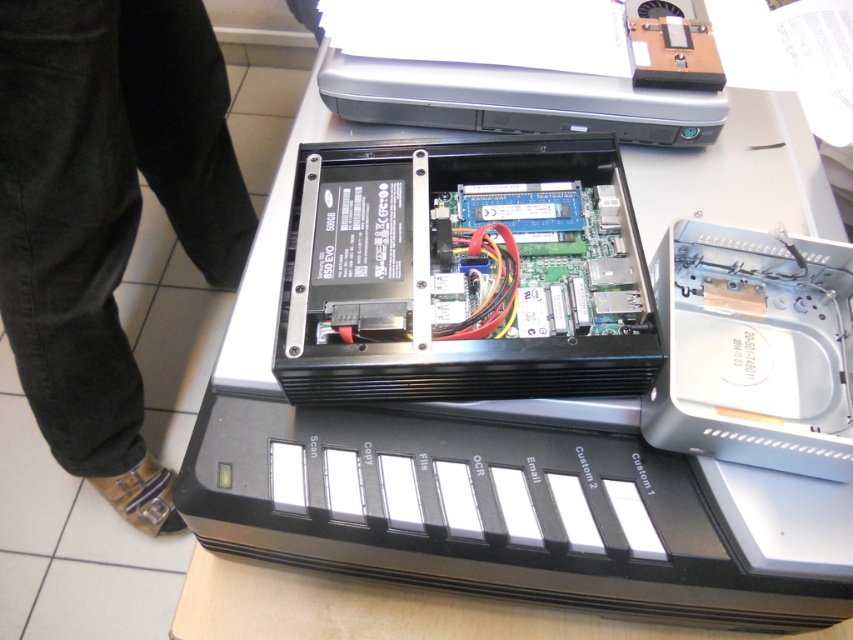
Which is above, black corduroy pants at lower center or satin silver printer at upper center?

Positioned higher is satin silver printer at upper center.

Which of these two, black corduroy pants at lower center or satin silver printer at upper center, stands shorter?

Standing shorter between the two is satin silver printer at upper center.

Is point (57, 225) more distant than point (355, 72)?

Yes, it is.

This screenshot has width=853, height=640. I want to click on black corduroy pants at lower center, so click(x=106, y=212).